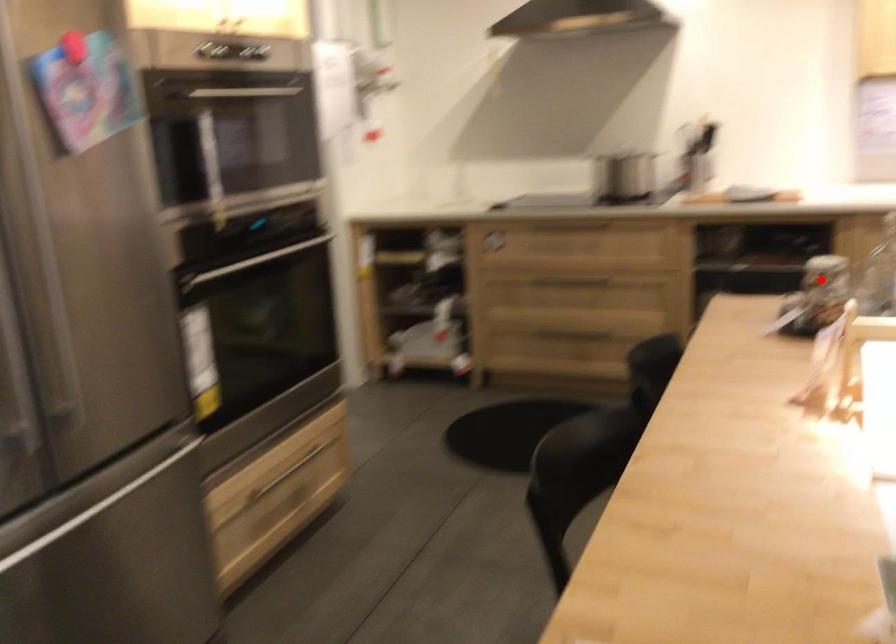
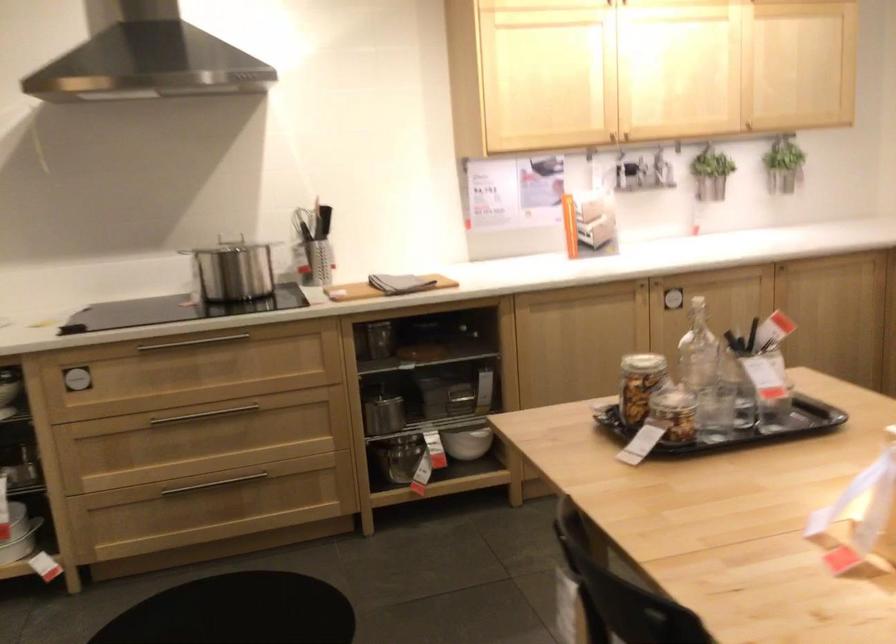
In the second image, find the point that corresponds to the highlighted location in the first image.

(640, 384)